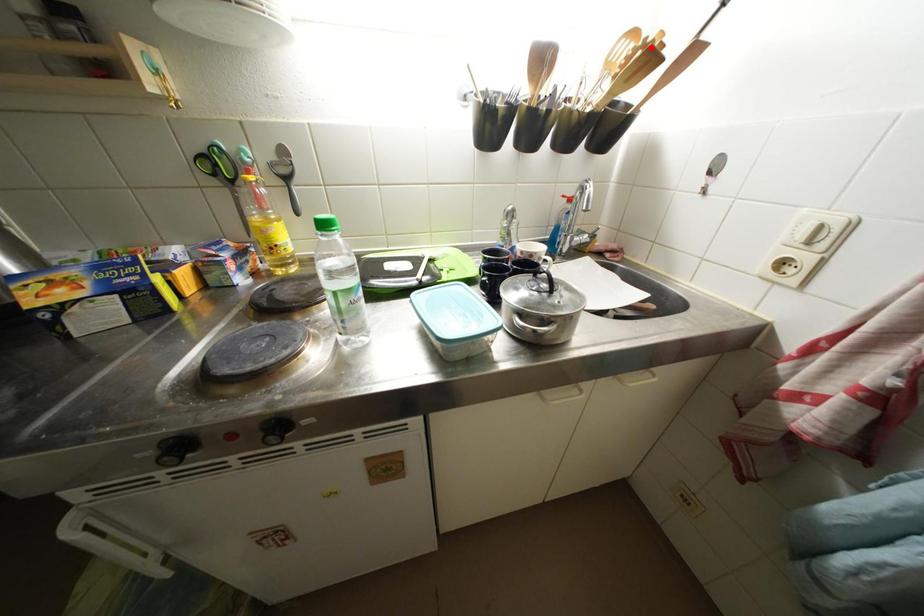
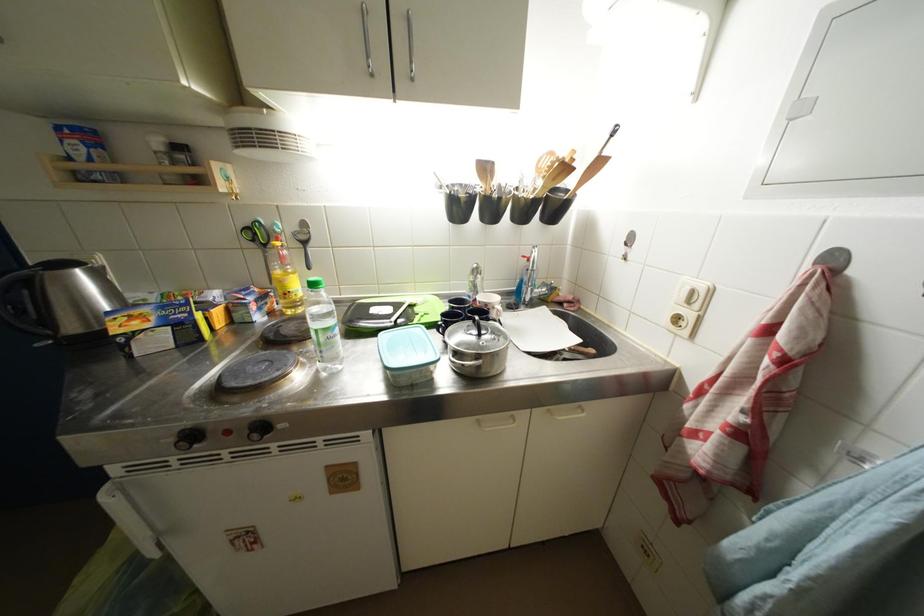
The point at the highlighted location is marked in the first image. Where is the corresponding point in the second image?

(565, 164)